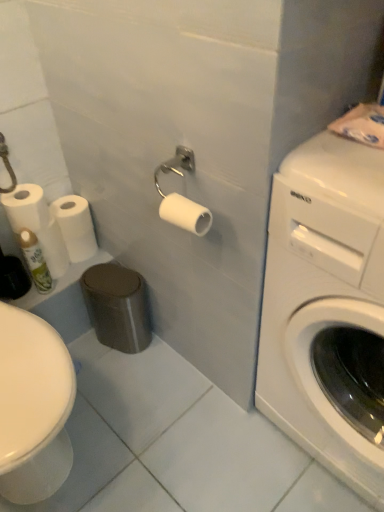
Question: Does white glossy washing machine at right turn towards green matte spray can at lower left?

Choices:
 (A) no
 (B) yes

Answer: (A)

Question: Considering the relative sizes of white glossy washing machine at right and green matte spray can at lower left in the image provided, is white glossy washing machine at right smaller than green matte spray can at lower left?

Choices:
 (A) yes
 (B) no

Answer: (B)

Question: Is white glossy washing machine at right beside green matte spray can at lower left?

Choices:
 (A) no
 (B) yes

Answer: (A)

Question: Can you confirm if white glossy washing machine at right is bigger than green matte spray can at lower left?

Choices:
 (A) yes
 (B) no

Answer: (A)

Question: Is white glossy washing machine at right positioned before green matte spray can at lower left?

Choices:
 (A) yes
 (B) no

Answer: (A)

Question: From the image's perspective, would you say white glossy washing machine at right is shown under green matte spray can at lower left?

Choices:
 (A) no
 (B) yes

Answer: (B)

Question: Is white matte toilet paper at left, placed as the second toilet paper when sorted from right to left, smaller than green matte spray can at lower left?

Choices:
 (A) yes
 (B) no

Answer: (B)

Question: Does white matte toilet paper at left, placed as the second toilet paper when sorted from right to left, lie in front of green matte spray can at lower left?

Choices:
 (A) no
 (B) yes

Answer: (A)

Question: Can you confirm if white matte toilet paper at left, placed as the second toilet paper when sorted from right to left, is shorter than green matte spray can at lower left?

Choices:
 (A) no
 (B) yes

Answer: (B)

Question: Does white matte toilet paper at left, placed as the second toilet paper when sorted from left to right, have a greater height compared to green matte spray can at lower left?

Choices:
 (A) no
 (B) yes

Answer: (A)

Question: Is white matte toilet paper at left, placed as the second toilet paper when sorted from left to right, next to green matte spray can at lower left and touching it?

Choices:
 (A) yes
 (B) no

Answer: (B)

Question: From the image's perspective, is white matte toilet paper at left, arranged as the 3th toilet paper when viewed from the front, beneath green matte spray can at lower left?

Choices:
 (A) yes
 (B) no

Answer: (B)

Question: Is white matte toilet paper at center, the 3th toilet paper when ordered from back to front, wider than white matte toilet paper at left, positioned as the 1th toilet paper in left-to-right order?

Choices:
 (A) yes
 (B) no

Answer: (B)